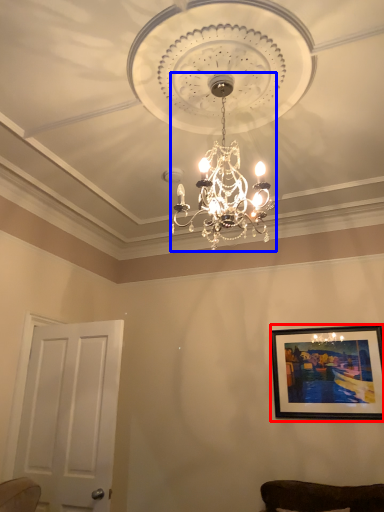
Question: Which point is further to the camera, picture frame (highlighted by a red box) or lamp (highlighted by a blue box)?

Choices:
 (A) picture frame
 (B) lamp

Answer: (A)